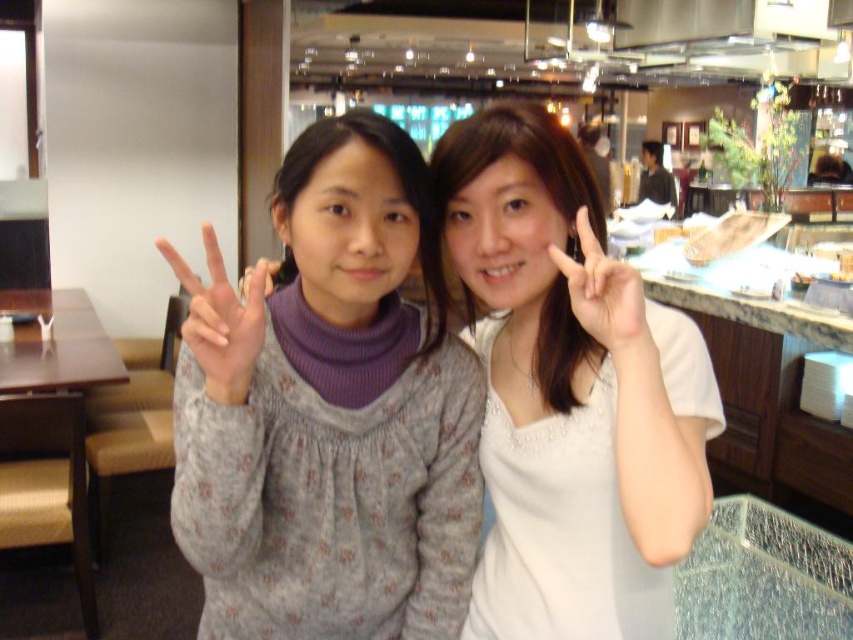
Is gray floral sweater at center positioned behind gray textured sweater at center?

No.

Does gray floral sweater at center have a lesser height compared to gray textured sweater at center?

No.

Is point (292, 556) positioned before point (202, 333)?

No.

What are the coordinates of `gray floral sweater at center` in the screenshot? It's located at tap(329, 412).

Does gray floral sweater at center have a lesser height compared to white matte hand at center?

No.

Between point (367, 208) and point (602, 330), which one is positioned behind?

Positioned behind is point (367, 208).

Locate an element on the screen. The image size is (853, 640). gray floral sweater at center is located at coordinates (329, 412).

Does point (558, 220) come farther from viewer compared to point (233, 346)?

Yes, point (558, 220) is behind point (233, 346).

Does white satin dress at center have a lesser width compared to gray textured sweater at center?

Incorrect, white satin dress at center's width is not less than gray textured sweater at center's.

What do you see at coordinates (570, 394) in the screenshot? This screenshot has width=853, height=640. I see `white satin dress at center` at bounding box center [570, 394].

This screenshot has width=853, height=640. Identify the location of white satin dress at center. (570, 394).